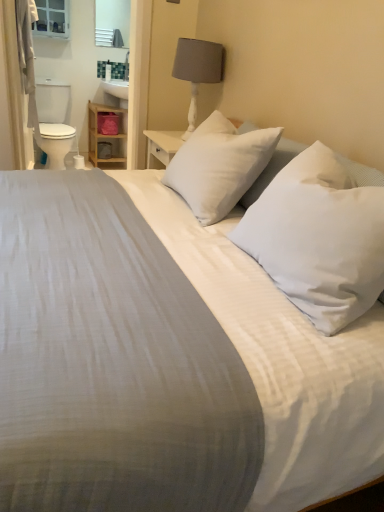
Question: Considering the relative positions of matte white medicine cabinet at upper left and wooden shelf at left in the image provided, is matte white medicine cabinet at upper left to the right of wooden shelf at left from the viewer's perspective?

Choices:
 (A) no
 (B) yes

Answer: (A)

Question: Can you confirm if matte white medicine cabinet at upper left is positioned to the left of wooden shelf at left?

Choices:
 (A) no
 (B) yes

Answer: (B)

Question: Is matte white medicine cabinet at upper left oriented away from wooden shelf at left?

Choices:
 (A) yes
 (B) no

Answer: (B)

Question: From the image's perspective, is matte white medicine cabinet at upper left below wooden shelf at left?

Choices:
 (A) yes
 (B) no

Answer: (B)

Question: Does matte white medicine cabinet at upper left lie behind wooden shelf at left?

Choices:
 (A) no
 (B) yes

Answer: (A)

Question: Does matte white medicine cabinet at upper left have a lesser height compared to wooden shelf at left?

Choices:
 (A) yes
 (B) no

Answer: (A)

Question: Is white glossy mirror at upper center in front of matte gray fabric lampshade at upper center?

Choices:
 (A) no
 (B) yes

Answer: (A)

Question: Is white glossy mirror at upper center wider than matte gray fabric lampshade at upper center?

Choices:
 (A) no
 (B) yes

Answer: (A)

Question: Is white glossy mirror at upper center oriented towards matte gray fabric lampshade at upper center?

Choices:
 (A) yes
 (B) no

Answer: (A)

Question: Is white glossy mirror at upper center looking in the opposite direction of matte gray fabric lampshade at upper center?

Choices:
 (A) yes
 (B) no

Answer: (B)

Question: From a real-world perspective, is white glossy mirror at upper center positioned under matte gray fabric lampshade at upper center based on gravity?

Choices:
 (A) no
 (B) yes

Answer: (A)

Question: Is white glossy mirror at upper center outside of matte gray fabric lampshade at upper center?

Choices:
 (A) yes
 (B) no

Answer: (A)

Question: From the image's perspective, is matte white medicine cabinet at upper left beneath white glossy toilet bowl at left?

Choices:
 (A) yes
 (B) no

Answer: (B)